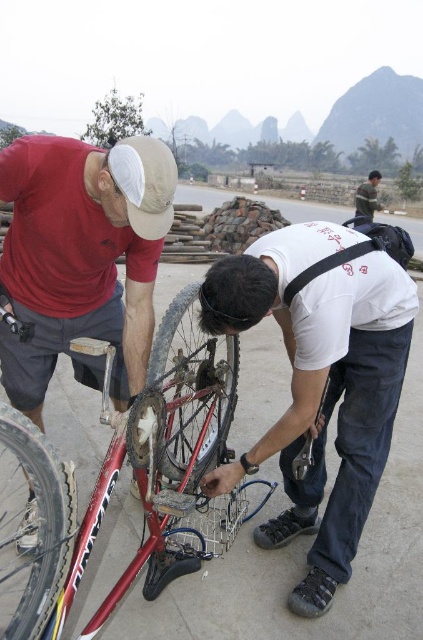
Question: Can you confirm if white matte shirt at center is positioned above matte red bicycle at left?

Choices:
 (A) yes
 (B) no

Answer: (B)

Question: Which of the following is the farthest from the observer?

Choices:
 (A) shiny metallic bicycle wheel at center
 (B) shiny metallic bicycle at center
 (C) shiny metallic bicycle wheel at lower left

Answer: (A)

Question: Which is farther from the shiny metallic bicycle at center?

Choices:
 (A) shiny metallic bicycle wheel at lower left
 (B) shiny metallic bicycle wheel at center

Answer: (A)

Question: Is shiny metallic bicycle at center further to the viewer compared to shiny metallic bicycle wheel at center?

Choices:
 (A) yes
 (B) no

Answer: (B)

Question: Considering the real-world distances, which object is farthest from the green striped sweater at upper right?

Choices:
 (A) shiny metallic bicycle wheel at center
 (B) matte red bicycle at left
 (C) shiny metallic bicycle wheel at lower left
 (D) shiny metallic bicycle at center

Answer: (C)

Question: Is shiny metallic bicycle at center wider than shiny metallic bicycle wheel at lower left?

Choices:
 (A) no
 (B) yes

Answer: (B)